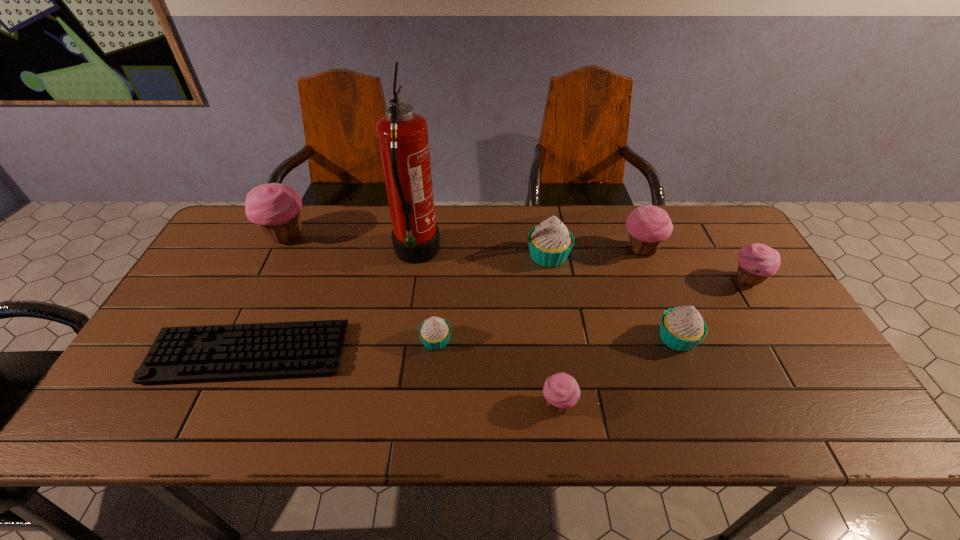
What are the coordinates of `the sixth cupcake from right to left` in the screenshot? It's located at (434, 332).

You are a GUI agent. You are given a task and a screenshot of the screen. Output one action in this format:
    pyautogui.click(x=<x>, y=<y>)
    Task: Click on the smallest white cupcake
    The image size is (960, 540).
    Given the screenshot: What is the action you would take?
    pyautogui.click(x=434, y=332)

Identify the location of the smallest pink cupcake. (561, 391).

Locate an element on the screen. The image size is (960, 540). the nearest object is located at coordinates (561, 391).

Locate an element on the screen. Image resolution: width=960 pixels, height=540 pixels. the shortest object is located at coordinates (306, 348).

You are a GUI agent. You are given a task and a screenshot of the screen. Output one action in this format:
    pyautogui.click(x=<x>, y=<y>)
    Task: Click on the blank space located on the front-facing side of the fire extinguisher
    This screenshot has height=540, width=960.
    Given the screenshot: What is the action you would take?
    pyautogui.click(x=541, y=254)

Identify the location of vacant area located on the back of the leftmost pink cupcake. The height and width of the screenshot is (540, 960). (299, 208).

Find the location of a particular element. This screenshot has height=540, width=960. free space located 0.050m on the front of the second biggest pink cupcake is located at coordinates (651, 276).

Where is `vacant space located on the back of the second white cupcake from left to right`? vacant space located on the back of the second white cupcake from left to right is located at coordinates (541, 214).

Where is `free space located 0.160m on the left of the rightmost object`? This screenshot has height=540, width=960. free space located 0.160m on the left of the rightmost object is located at coordinates (674, 280).